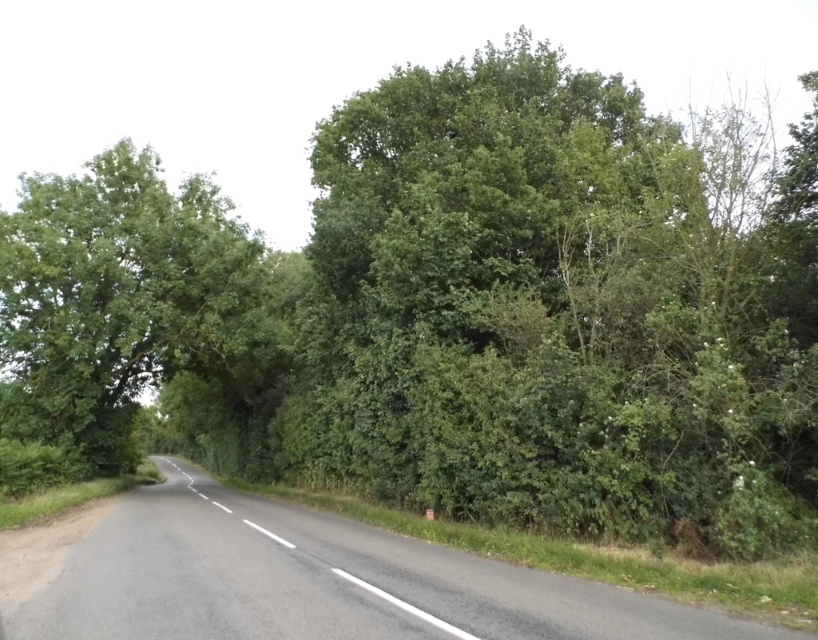
Who is positioned more to the left, black asphalt road at center or green leafy tree at left?

green leafy tree at left

This screenshot has height=640, width=818. Find the location of `black asphalt road at center`. black asphalt road at center is located at coordinates (318, 580).

In order to click on black asphalt road at center in this screenshot , I will do `click(318, 580)`.